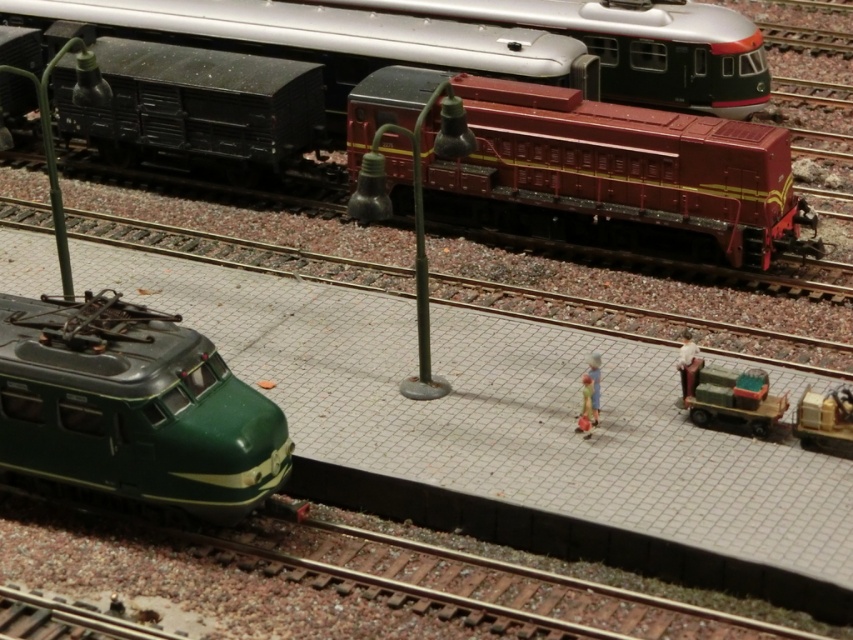
Between point (389, 116) and point (491, 3), which one is positioned behind?

The point (491, 3) is more distant.

Which is above, maroon metallic locomotive at upper center or metallic silver train at upper center?

metallic silver train at upper center is above.

Measure the distance between point (257,51) and camera.

Point (257,51) is 17.19 meters away from camera.

At what (x,y) coordinates should I click in order to perform the action: click on maroon metallic locomotive at upper center. Please return your answer as a coordinate pair (x, y). This screenshot has width=853, height=640. Looking at the image, I should click on (463, 106).

Is point (311, 86) closer to viewer compared to point (15, 429)?

No, (311, 86) is further to viewer.

Does maroon metallic locomotive at upper center have a smaller size compared to green glossy train at lower left?

Yes.

Does point (91, 116) come in front of point (190, 385)?

No.

Identify the location of maroon metallic locomotive at upper center. (463, 106).

Does metallic silver train at upper center have a lesser width compared to green glossy train at lower left?

Indeed, metallic silver train at upper center has a lesser width compared to green glossy train at lower left.

Does metallic silver train at upper center have a larger size compared to green glossy train at lower left?

No.

Find the location of a particular element. The height and width of the screenshot is (640, 853). metallic silver train at upper center is located at coordinates (463, 38).